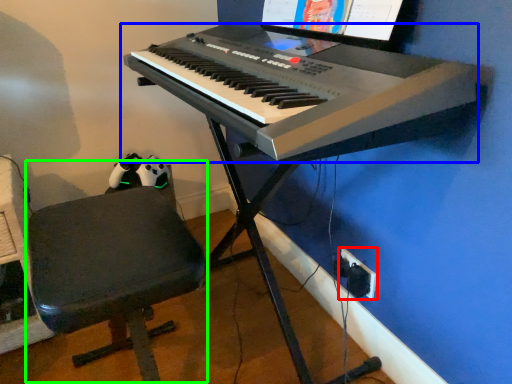
Question: Based on their relative distances, which object is nearer to plug (highlighted by a red box)? Choose from musical keyboard (highlighted by a blue box) and computer chair (highlighted by a green box).

Choices:
 (A) musical keyboard
 (B) computer chair

Answer: (A)